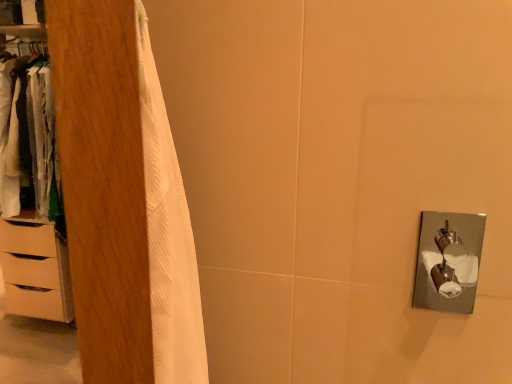
Question: From a real-world perspective, relative to white matte chest of drawers at left, is wooden wardrobe at left vertically above or below?

Choices:
 (A) above
 (B) below

Answer: (A)

Question: Is wooden wardrobe at left situated inside white matte chest of drawers at left or outside?

Choices:
 (A) inside
 (B) outside

Answer: (B)

Question: Considering the real-world distances, which object is farthest from the white matte chest of drawers at left?

Choices:
 (A) white wood dresser at left
 (B) wooden wardrobe at left

Answer: (B)

Question: Considering the real-world distances, which object is farthest from the white matte chest of drawers at left?

Choices:
 (A) white wood dresser at left
 (B) wooden wardrobe at left

Answer: (B)